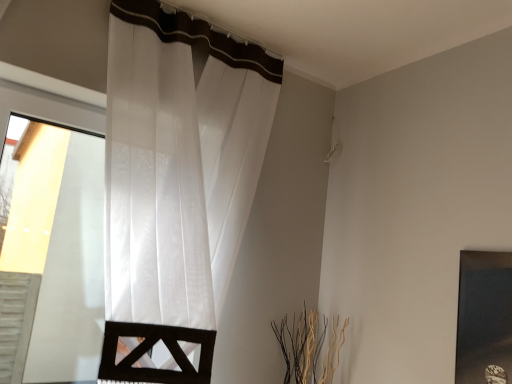
The image size is (512, 384). What do you see at coordinates (175, 185) in the screenshot? I see `white sheer curtain at left` at bounding box center [175, 185].

You are a GUI agent. You are given a task and a screenshot of the screen. Output one action in this format:
    pyautogui.click(x=<x>, y=<y>)
    Task: Click on the white sheer curtain at left
    Image resolution: width=512 pixels, height=384 pixels.
    Given the screenshot: What is the action you would take?
    pyautogui.click(x=175, y=185)

The width and height of the screenshot is (512, 384). What do you see at coordinates (484, 318) in the screenshot?
I see `matte black picture frame at right` at bounding box center [484, 318].

Locate an element on the screen. Image resolution: width=512 pixels, height=384 pixels. matte black picture frame at right is located at coordinates (484, 318).

This screenshot has width=512, height=384. What are the coordinates of `white sheer curtain at left` in the screenshot? It's located at (175, 185).

Is matte black picture frame at right to the right of white sheer curtain at left from the viewer's perspective?

Yes.

Considering the relative positions of matte black picture frame at right and white sheer curtain at left in the image provided, is matte black picture frame at right behind white sheer curtain at left?

Yes, matte black picture frame at right is further from the viewer.

Which is farther from the camera, (479, 329) or (123, 244)?

The point (123, 244) is farther.

From the image's perspective, does matte black picture frame at right appear lower than white sheer curtain at left?

Yes, from the image's perspective, matte black picture frame at right is beneath white sheer curtain at left.

From a real-world perspective, does matte black picture frame at right sit lower than white sheer curtain at left?

Yes.

Considering the sizes of objects matte black picture frame at right and white sheer curtain at left in the image provided, who is thinner, matte black picture frame at right or white sheer curtain at left?

Thinner between the two is matte black picture frame at right.

Considering the relative sizes of matte black picture frame at right and white sheer curtain at left in the image provided, is matte black picture frame at right shorter than white sheer curtain at left?

Yes, matte black picture frame at right is shorter than white sheer curtain at left.

In terms of size, does matte black picture frame at right appear bigger or smaller than white sheer curtain at left?

In the image, matte black picture frame at right appears to be smaller than white sheer curtain at left.

Is matte black picture frame at right positioned beyond the bounds of white sheer curtain at left?

Yes, matte black picture frame at right is located beyond the bounds of white sheer curtain at left.

Is matte black picture frame at right next to white sheer curtain at left and touching it?

No.

Is white sheer curtain at left at the back of matte black picture frame at right?

No, matte black picture frame at right is not facing the opposite direction of white sheer curtain at left.

What's the angular difference between matte black picture frame at right and white sheer curtain at left's facing directions?

86.1 degrees.

This screenshot has height=384, width=512. What are the coordinates of `curtain lying on the left of matte black picture frame at right` in the screenshot? It's located at (175, 185).

Between white sheer curtain at left and matte black picture frame at right, which one appears on the left side from the viewer's perspective?

Positioned to the left is white sheer curtain at left.

Which object is more forward, white sheer curtain at left or matte black picture frame at right?

Positioned in front is white sheer curtain at left.

Is point (170, 75) farther from viewer compared to point (474, 274)?

Yes, it is.

From the image's perspective, which one is positioned lower, white sheer curtain at left or matte black picture frame at right?

matte black picture frame at right appears lower in the image.

From a real-world perspective, is white sheer curtain at left above or below matte black picture frame at right?

white sheer curtain at left is above matte black picture frame at right.

Which object is wider, white sheer curtain at left or matte black picture frame at right?

With larger width is white sheer curtain at left.

Can you confirm if white sheer curtain at left is taller than matte black picture frame at right?

Correct, white sheer curtain at left is much taller as matte black picture frame at right.

Considering the sizes of objects white sheer curtain at left and matte black picture frame at right in the image provided, who is bigger, white sheer curtain at left or matte black picture frame at right?

With larger size is white sheer curtain at left.

From the picture: Is matte black picture frame at right located within white sheer curtain at left?

No, matte black picture frame at right is not a part of white sheer curtain at left.

Is white sheer curtain at left not near matte black picture frame at right?

white sheer curtain at left is positioned a significant distance from matte black picture frame at right.

From the picture: Is white sheer curtain at left oriented towards matte black picture frame at right?

No, white sheer curtain at left is not turned towards matte black picture frame at right.

Find the location of a particular element. This screenshot has width=512, height=384. picture frame behind the white sheer curtain at left is located at coordinates (484, 318).

Find the location of a particular element. picture frame below the white sheer curtain at left (from the image's perspective) is located at coordinates (484, 318).

In order to click on curtain located above the matte black picture frame at right (from a real-world perspective) in this screenshot , I will do `click(175, 185)`.